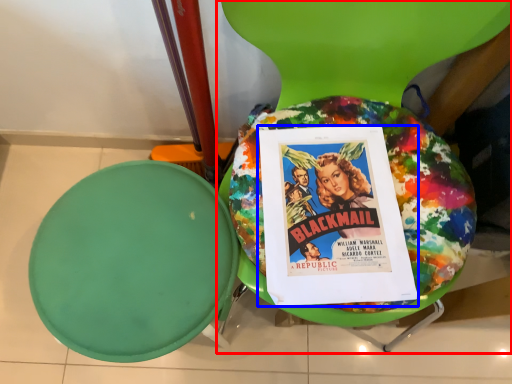
Question: Which point is closer to the camera, chair (highlighted by a red box) or comic book (highlighted by a blue box)?

Choices:
 (A) chair
 (B) comic book

Answer: (A)